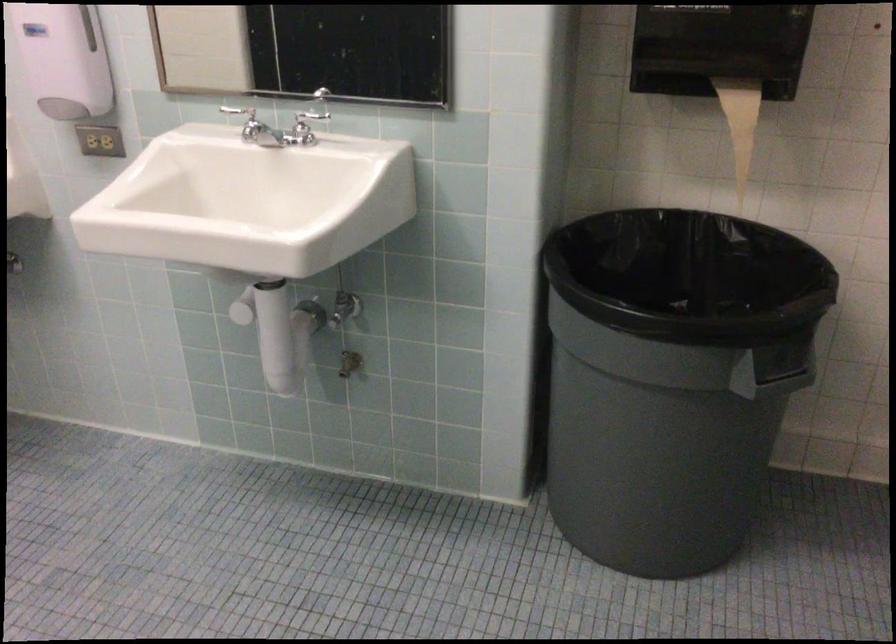
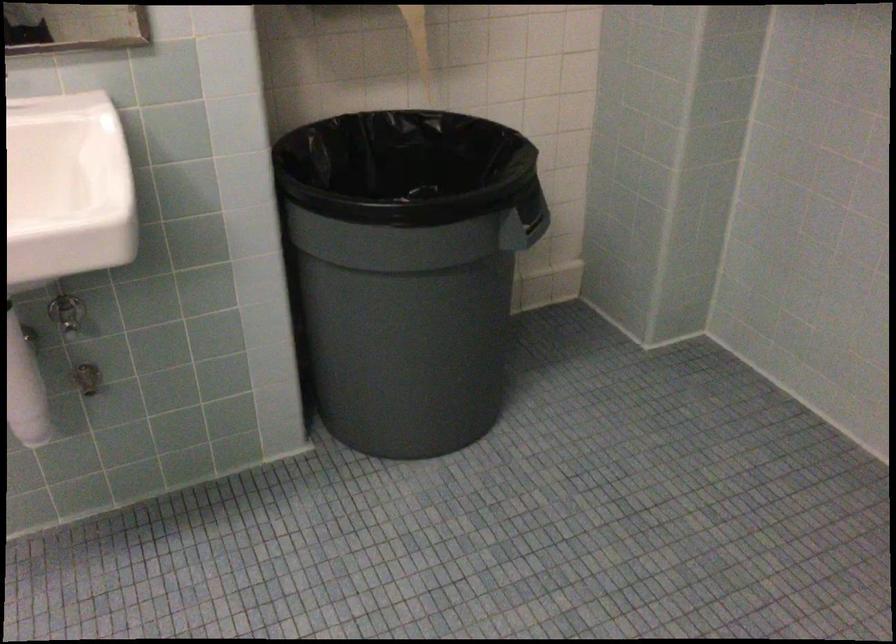
Locate, in the second image, the point that corresponds to (579,486) in the first image.

(382, 395)